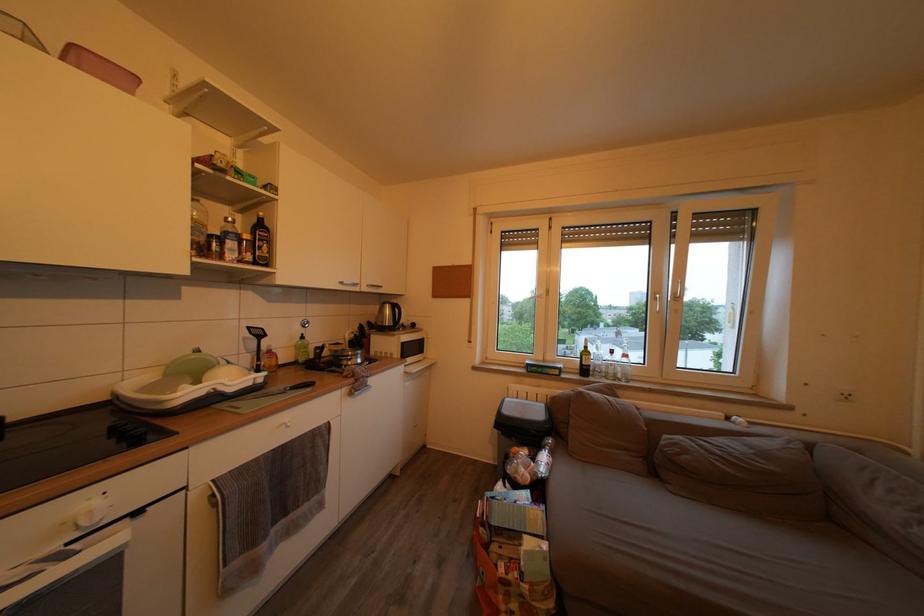
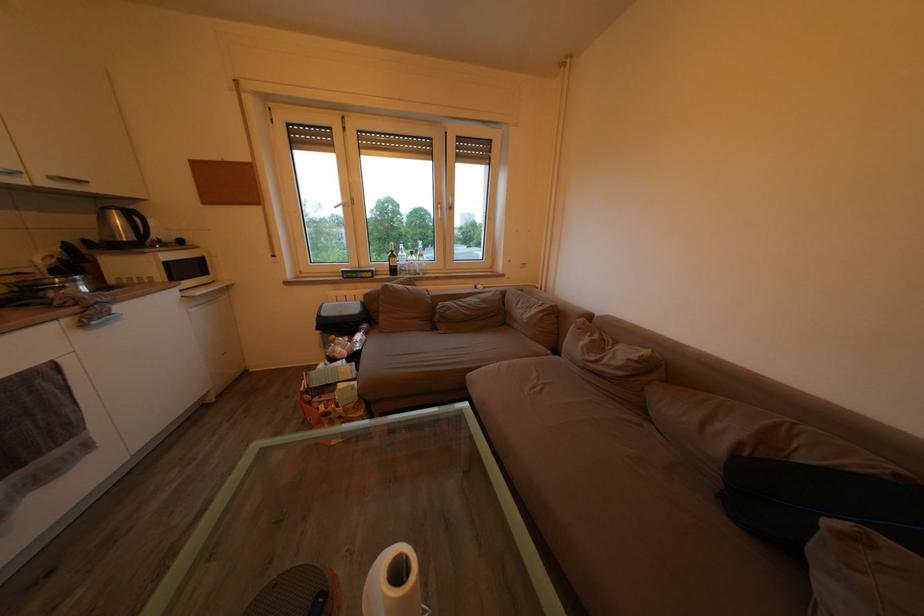
How did the camera likely rotate?

The camera rotated toward right-down.